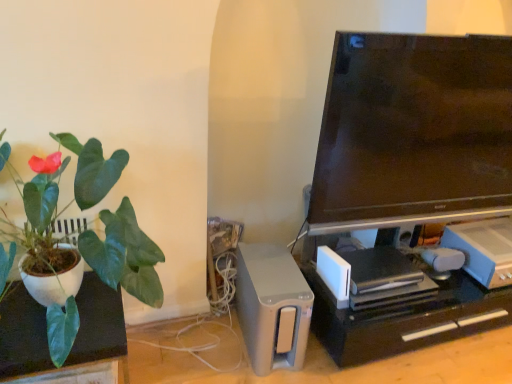
Question: Is matte black tv at upper right not within satin silver speaker at lower center, the first appliance viewed from the left?

Choices:
 (A) yes
 (B) no

Answer: (A)

Question: Does matte black tv at upper right have a greater height compared to satin silver speaker at lower center, the second appliance in the right-to-left sequence?

Choices:
 (A) yes
 (B) no

Answer: (A)

Question: Is matte black tv at upper right looking in the opposite direction of satin silver speaker at lower center, the second appliance in the right-to-left sequence?

Choices:
 (A) no
 (B) yes

Answer: (A)

Question: Does matte black tv at upper right appear on the left side of satin silver speaker at lower center, the first appliance viewed from the left?

Choices:
 (A) yes
 (B) no

Answer: (B)

Question: Does matte black tv at upper right have a larger size compared to satin silver speaker at lower center, the second appliance in the right-to-left sequence?

Choices:
 (A) yes
 (B) no

Answer: (A)

Question: Considering the relative positions of matte black tv at upper right and satin silver speaker at lower center, the first appliance viewed from the left, in the image provided, is matte black tv at upper right to the right of satin silver speaker at lower center, the first appliance viewed from the left, from the viewer's perspective?

Choices:
 (A) yes
 (B) no

Answer: (A)

Question: Is white plastic game console at lower right, the 1th appliance positioned from the right, at the right side of satin silver speaker at lower center, the first appliance viewed from the left?

Choices:
 (A) yes
 (B) no

Answer: (A)

Question: Can you confirm if white plastic game console at lower right, the 1th appliance positioned from the right, is positioned to the left of satin silver speaker at lower center, the second appliance in the right-to-left sequence?

Choices:
 (A) no
 (B) yes

Answer: (A)

Question: Does white plastic game console at lower right, which is the second appliance in left-to-right order, have a greater width compared to satin silver speaker at lower center, the second appliance in the right-to-left sequence?

Choices:
 (A) yes
 (B) no

Answer: (B)

Question: Is white plastic game console at lower right, the 1th appliance positioned from the right, looking in the opposite direction of satin silver speaker at lower center, the second appliance in the right-to-left sequence?

Choices:
 (A) yes
 (B) no

Answer: (B)

Question: Could satin silver speaker at lower center, the first appliance viewed from the left, be considered to be inside white plastic game console at lower right, which is the second appliance in left-to-right order?

Choices:
 (A) no
 (B) yes

Answer: (A)

Question: From a real-world perspective, is white plastic game console at lower right, which is the second appliance in left-to-right order, positioned under satin silver speaker at lower center, the first appliance viewed from the left, based on gravity?

Choices:
 (A) no
 (B) yes

Answer: (A)

Question: Could you tell me if white matte plant pot at left is turned towards white plastic game console at lower right, the 1th appliance positioned from the right?

Choices:
 (A) no
 (B) yes

Answer: (A)